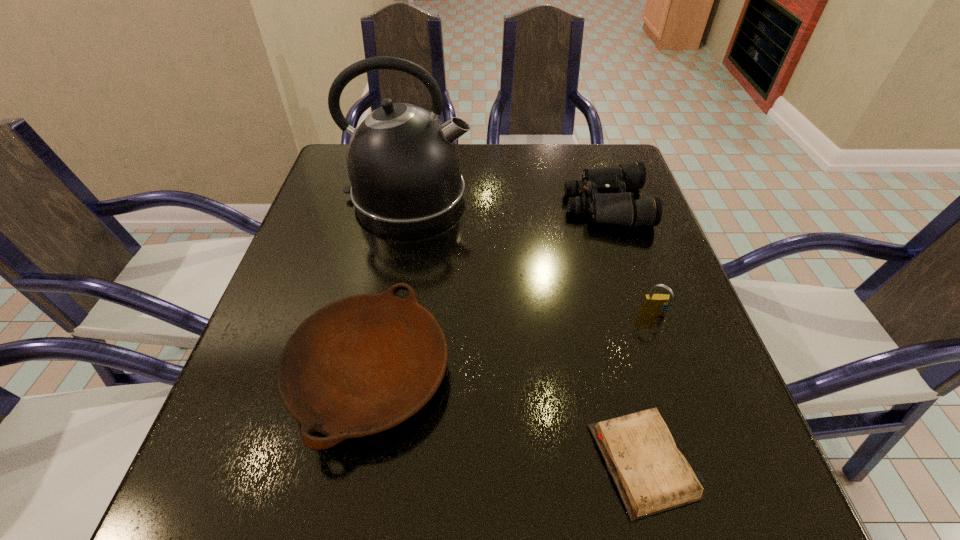
I want to click on diary that is positioned at the right edge, so click(x=652, y=476).

The width and height of the screenshot is (960, 540). I want to click on object that is at the far left corner, so click(x=402, y=161).

Locate an element on the screen. object that is at the near left corner is located at coordinates (360, 365).

I want to click on object located at the far right corner, so click(x=608, y=202).

Locate an element on the screen. The image size is (960, 540). object that is at the near right corner is located at coordinates coord(652,476).

Image resolution: width=960 pixels, height=540 pixels. What are the coordinates of `vacant area at the far edge of the desktop` in the screenshot? It's located at (492, 185).

At what (x,y) coordinates should I click in order to perform the action: click on blank area at the left edge. Please return your answer as a coordinate pair (x, y). Looking at the image, I should click on click(308, 232).

At what (x,y) coordinates should I click in order to perform the action: click on blank space at the right edge of the desktop. Please return your answer as a coordinate pair (x, y). Looking at the image, I should click on (697, 315).

Identify the location of vacant space at the near right corner of the desktop. This screenshot has height=540, width=960. (724, 501).

You are a GUI agent. You are given a task and a screenshot of the screen. Output one action in this format:
    pyautogui.click(x=<x>, y=<y>)
    Task: Click on the vacant area that lies between the plate and the binoculars
    The width and height of the screenshot is (960, 540).
    Given the screenshot: What is the action you would take?
    pyautogui.click(x=488, y=289)